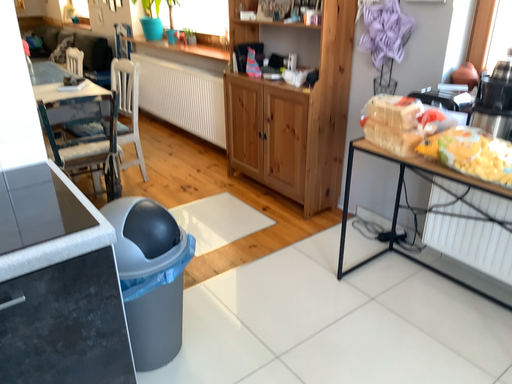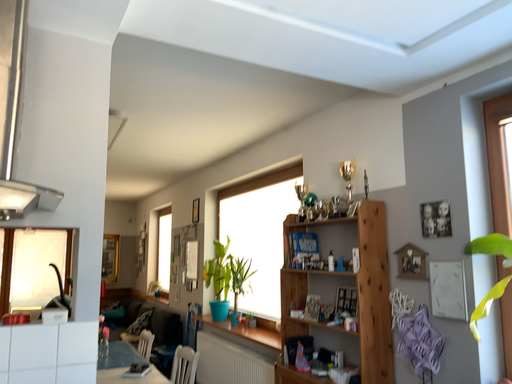
Question: Which way did the camera rotate in the video?

Choices:
 (A) rotated downward
 (B) rotated upward

Answer: (B)